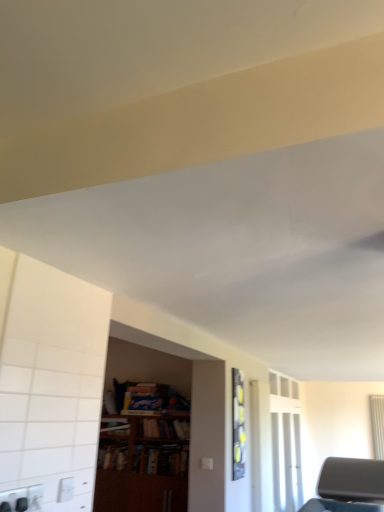
Question: Does wooden bookcase at center have a lesser width compared to transparent glass door at right?

Choices:
 (A) no
 (B) yes

Answer: (A)

Question: From a real-world perspective, is wooden bookcase at center located higher than transparent glass door at right?

Choices:
 (A) yes
 (B) no

Answer: (B)

Question: Is the position of wooden bookcase at center more distant than that of transparent glass door at right?

Choices:
 (A) no
 (B) yes

Answer: (A)

Question: Is wooden bookcase at center located outside transparent glass door at right?

Choices:
 (A) yes
 (B) no

Answer: (A)

Question: Does wooden bookcase at center have a larger size compared to transparent glass door at right?

Choices:
 (A) no
 (B) yes

Answer: (B)

Question: Is white plastic electric outlet at lower left wider or thinner than wooden bookshelf at center?

Choices:
 (A) thin
 (B) wide

Answer: (A)

Question: Would you say white plastic electric outlet at lower left is to the left or to the right of wooden bookshelf at center in the picture?

Choices:
 (A) right
 (B) left

Answer: (B)

Question: Is white plastic electric outlet at lower left spatially inside wooden bookshelf at center, or outside of it?

Choices:
 (A) inside
 (B) outside

Answer: (B)

Question: From a real-world perspective, is white plastic electric outlet at lower left physically located above or below wooden bookshelf at center?

Choices:
 (A) above
 (B) below

Answer: (B)

Question: Is transparent glass door at right bigger or smaller than wooden bookcase at center?

Choices:
 (A) small
 (B) big

Answer: (A)

Question: In the image, is transparent glass door at right on the left side or the right side of wooden bookcase at center?

Choices:
 (A) right
 (B) left

Answer: (A)

Question: From a real-world perspective, is transparent glass door at right physically located above or below wooden bookcase at center?

Choices:
 (A) above
 (B) below

Answer: (A)

Question: Considering the positions of transparent glass door at right and wooden bookcase at center in the image, is transparent glass door at right wider or thinner than wooden bookcase at center?

Choices:
 (A) thin
 (B) wide

Answer: (A)

Question: Relative to transparent glass door at right, is wooden bookshelf at center in front or behind?

Choices:
 (A) behind
 (B) front

Answer: (B)

Question: Looking at their shapes, would you say wooden bookshelf at center is wider or thinner than transparent glass door at right?

Choices:
 (A) thin
 (B) wide

Answer: (B)